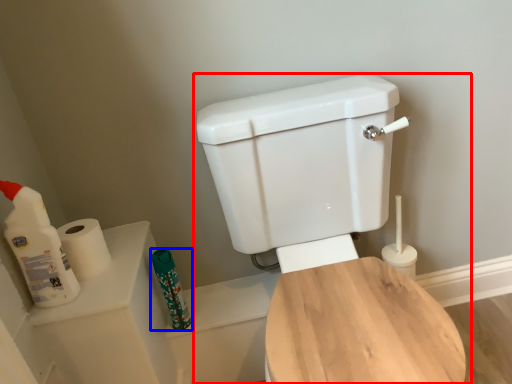
Question: Which of the following is the closest to the observer, toilet (highlighted by a red box) or toiletry (highlighted by a blue box)?

Choices:
 (A) toilet
 (B) toiletry

Answer: (A)